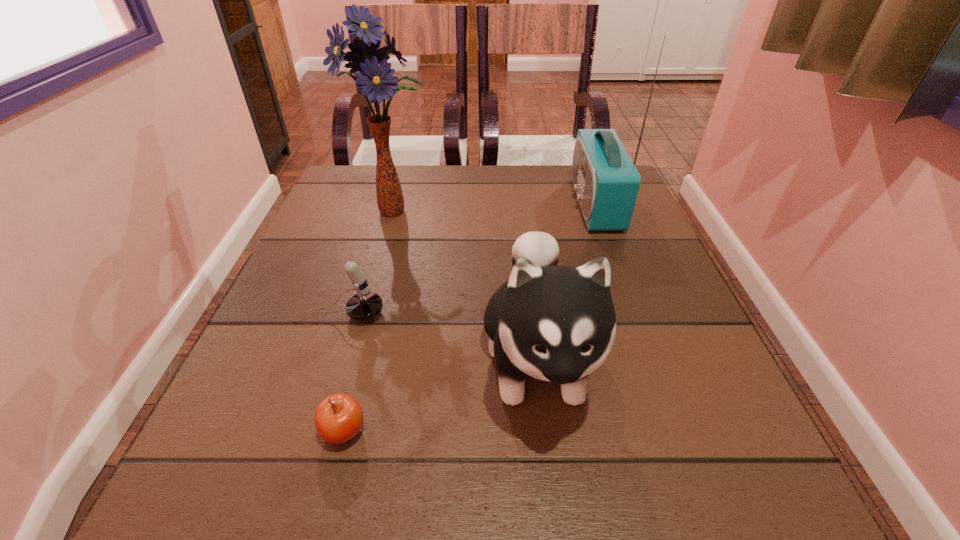
The image size is (960, 540). I want to click on flower arrangement, so click(x=374, y=76).

What are the coordinates of `the rightmost object` in the screenshot? It's located at (606, 181).

The image size is (960, 540). In order to click on puppy in this screenshot , I will do (556, 323).

Locate an element on the screen. This screenshot has width=960, height=540. the fourth object from left to right is located at coordinates (556, 323).

This screenshot has width=960, height=540. I want to click on the second shortest object, so click(x=365, y=305).

Locate an element on the screen. This screenshot has width=960, height=540. the shortest object is located at coordinates (338, 418).

Locate an element on the screen. This screenshot has height=540, width=960. vacant region located 0.320m on the front of the flower arrangement is located at coordinates coord(362,332).

The image size is (960, 540). Find the location of `free location located on the front panel of the rightmost object`. free location located on the front panel of the rightmost object is located at coordinates (549, 204).

I want to click on vacant space situated 0.120m on the front panel of the rightmost object, so click(x=525, y=204).

I want to click on free space located on the front panel of the rightmost object, so tap(451, 204).